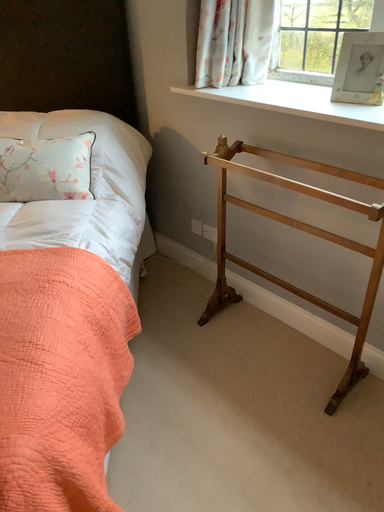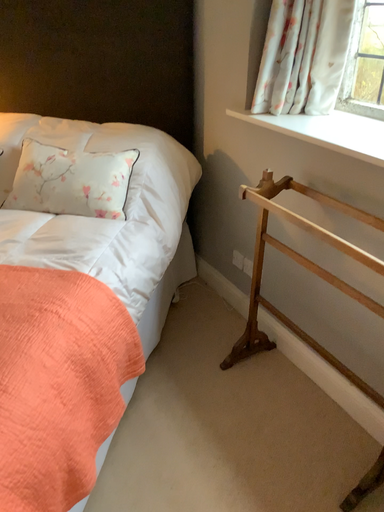
Question: Which way did the camera rotate in the video?

Choices:
 (A) rotated right
 (B) rotated left

Answer: (B)